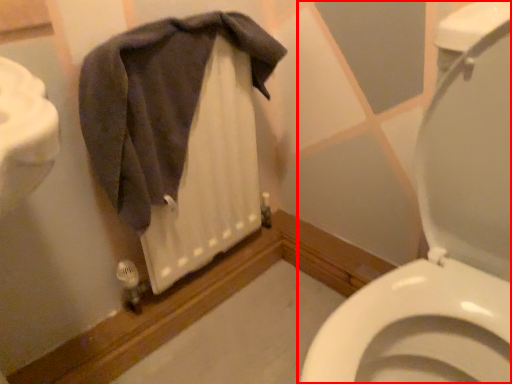
Question: Observing the image, what is the correct spatial positioning of toilet (annotated by the red box) in reference to bath towel?

Choices:
 (A) right
 (B) left

Answer: (A)